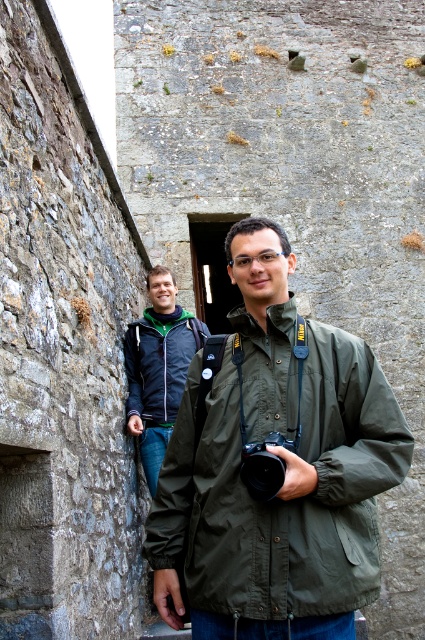
Between olive green fabric jacket at center and dark blue jacket at center, which one appears on the right side from the viewer's perspective?

olive green fabric jacket at center

Can you confirm if olive green fabric jacket at center is positioned to the right of dark blue jacket at center?

Yes, olive green fabric jacket at center is to the right of dark blue jacket at center.

Which is behind, point (340, 518) or point (141, 355)?

Point (141, 355)

The width and height of the screenshot is (425, 640). What are the coordinates of `olive green fabric jacket at center` in the screenshot? It's located at (280, 499).